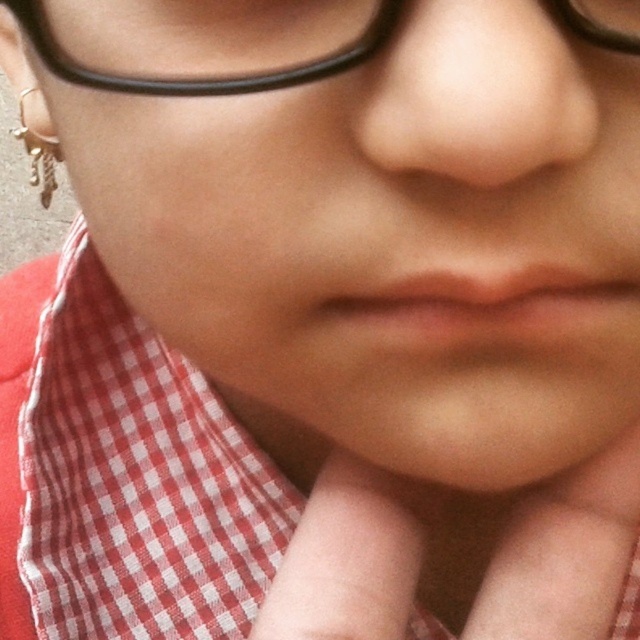
You are a photographer adjusting your camera settings to capture the scene. You notice the black plastic glasses at upper center and the gold metallic chain at lower left. Based on their positions, which object is closer to the camera lens?

The black plastic glasses at upper center is below the gold metallic chain at lower left, meaning the gold metallic chain at lower left is closer to the camera lens since objects higher in the frame are typically nearer when the camera is positioned at eye level.

You are a photographer adjusting the lighting for a portrait. You notice the black plastic glasses at upper center and the gold metallic chain at lower left in the frame. Which object is positioned higher in the image?

The black plastic glasses at upper center are positioned higher in the image than the gold metallic chain at lower left.

You are a photographer adjusting your camera settings to focus on the gold metallic chain at lower left. Since the red checkered fabric at center is in the way, can you tell me if you need to adjust the focus upwards or downwards to capture the chain without obstruction?

The red checkered fabric at center is located below the gold metallic chain at lower left, so to focus on the gold metallic chain at lower left without obstruction, you should adjust the focus upwards.